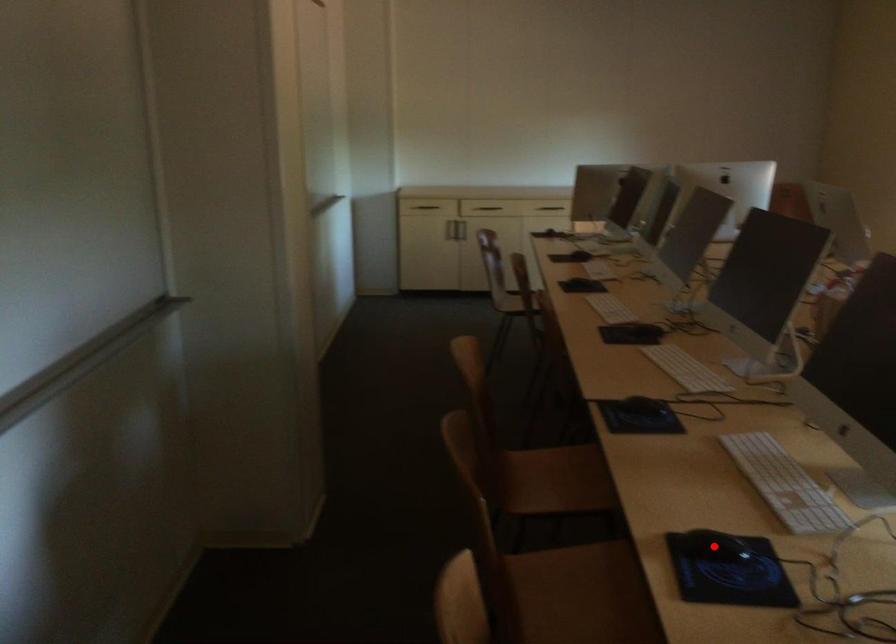
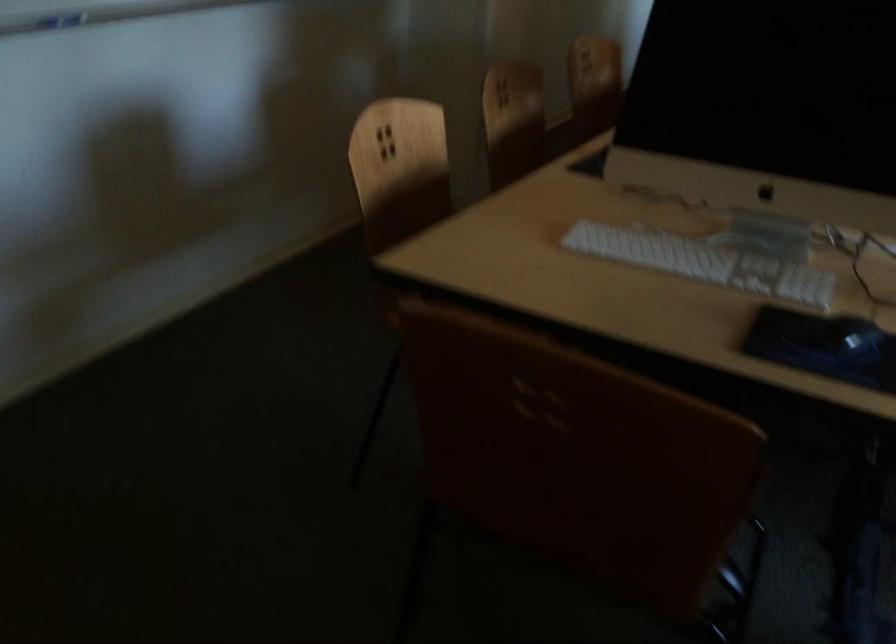
Question: I am providing you with two images of the same scene from different viewpoints. A red point is marked on the first image. Can you still see the location of the red point in image 2?

Choices:
 (A) Yes
 (B) No

Answer: (B)